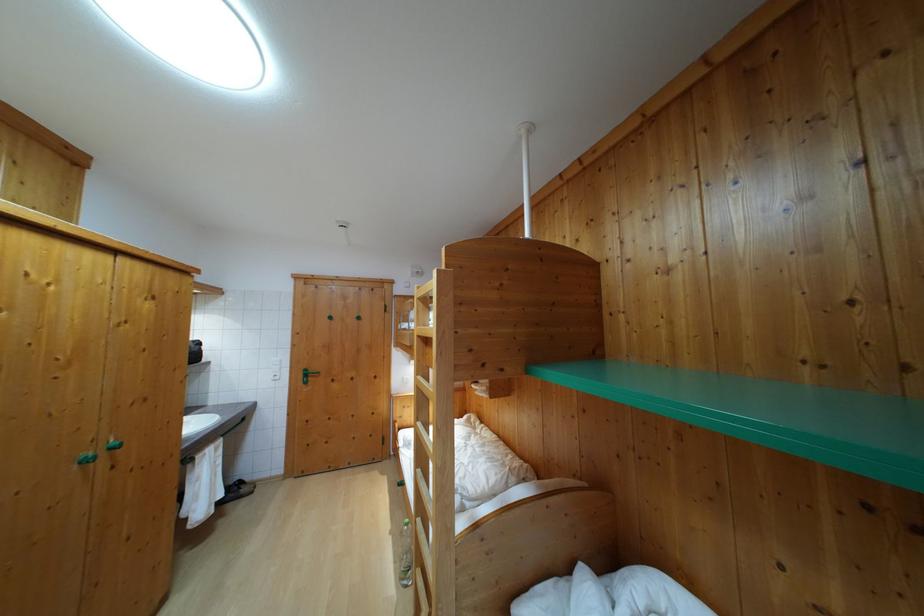
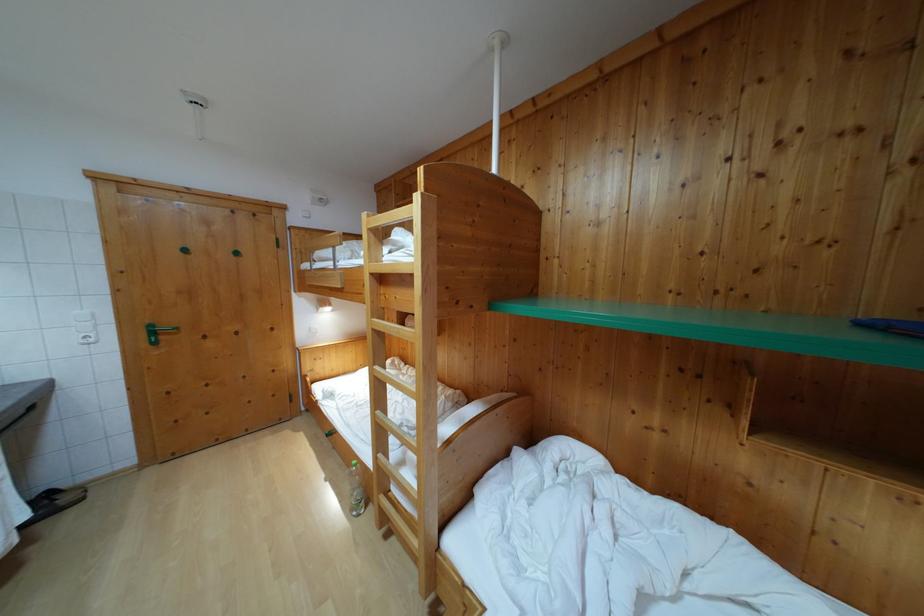
In the second image, find the point that corresponds to pixel 410 532 in the first image.

(359, 472)